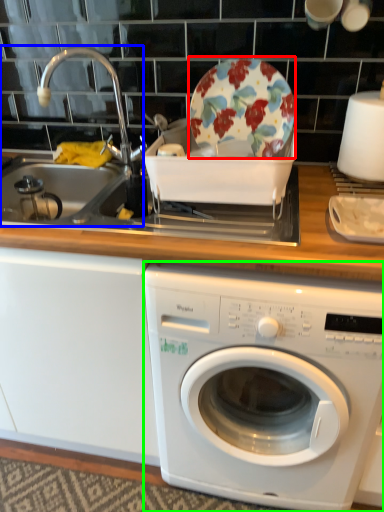
Question: Which is nearer to the plate (highlighted by a red box)? sink (highlighted by a blue box) or washing machine (highlighted by a green box).

Choices:
 (A) sink
 (B) washing machine

Answer: (A)